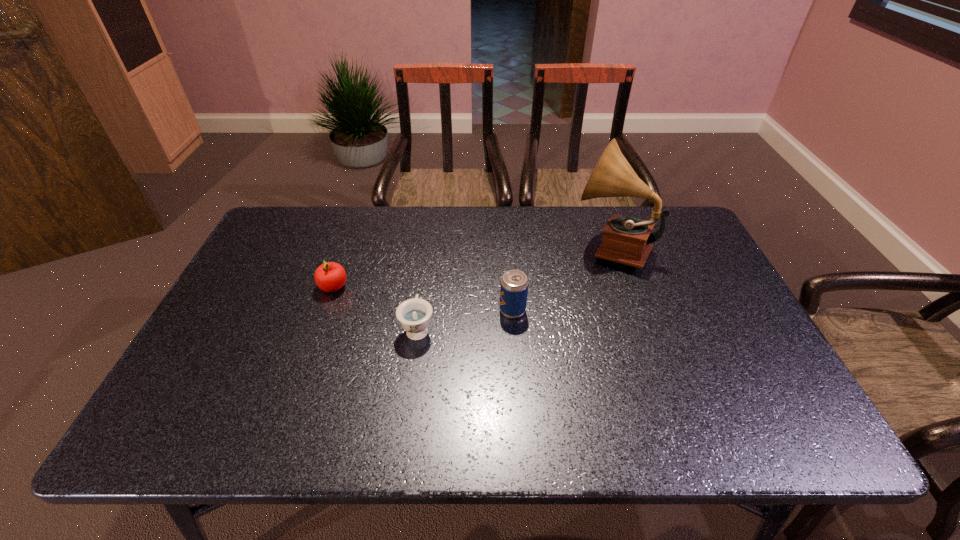
I want to click on empty space that is in between the phonograph record and the third object from left to right, so click(x=562, y=279).

Image resolution: width=960 pixels, height=540 pixels. Identify the location of blank region between the third tallest object and the shortest object. (375, 308).

The image size is (960, 540). Find the location of `free space that is in between the third nearest object and the phonograph record`. free space that is in between the third nearest object and the phonograph record is located at coordinates pos(472,267).

You are a GUI agent. You are given a task and a screenshot of the screen. Output one action in this format:
    pyautogui.click(x=<x>, y=<y>)
    Task: Click on the third closest object to the third nearest object
    
    Given the screenshot: What is the action you would take?
    pyautogui.click(x=627, y=240)

Locate an element on the screen. The height and width of the screenshot is (540, 960). object that stands as the third closest to the beer can is located at coordinates (330, 277).

At what (x,y) coordinates should I click in order to perform the action: click on free spot that satisfies the following two spatial constraints: 1. on the side of the third object from left to right with the handle; 2. on the right side of the shortest object. Please return your answer as a coordinate pair (x, y). Image resolution: width=960 pixels, height=540 pixels. Looking at the image, I should click on click(x=420, y=310).